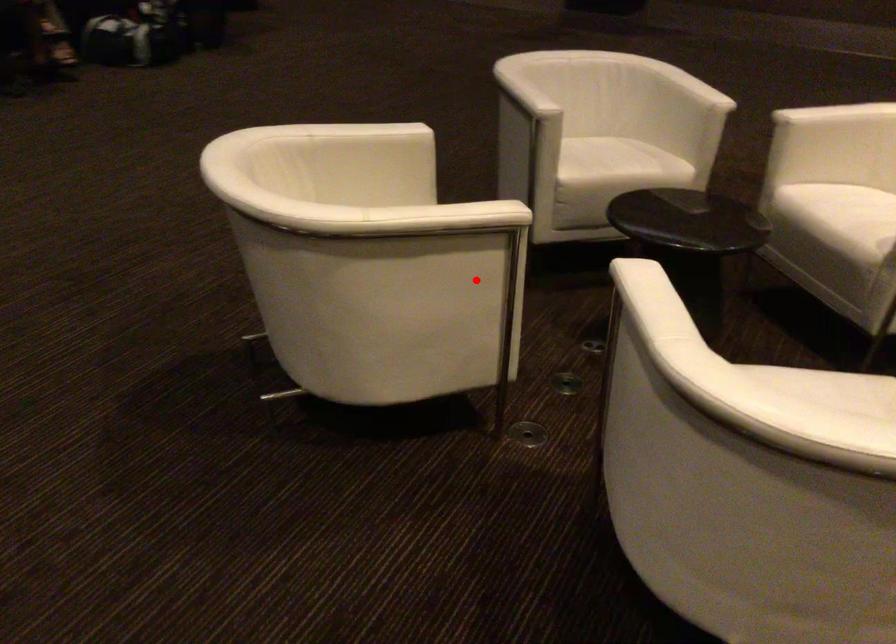
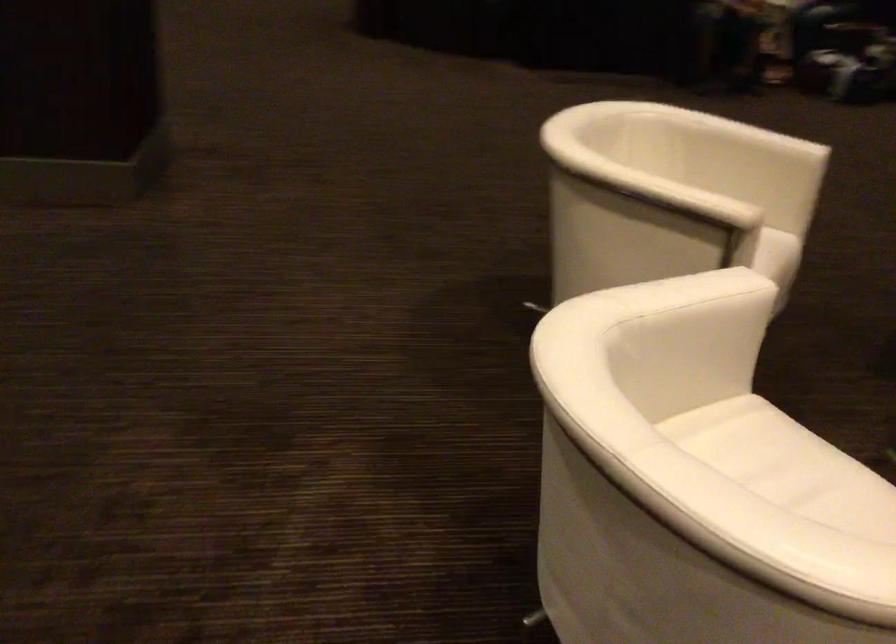
In the second image, find the point that corresponds to the highlighted location in the first image.

(676, 261)